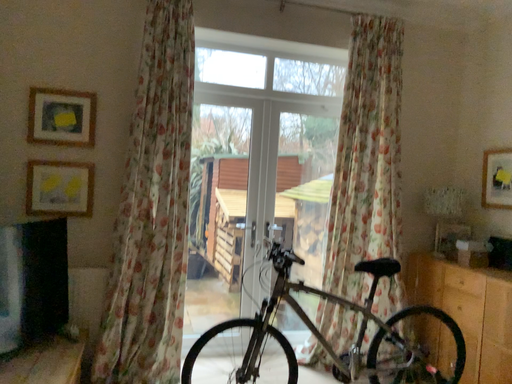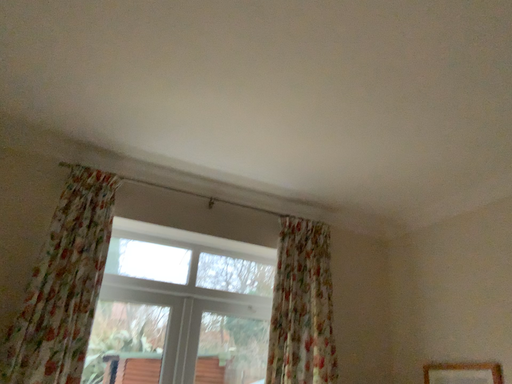
Question: How did the camera likely rotate when shooting the video?

Choices:
 (A) rotated upward
 (B) rotated downward

Answer: (A)